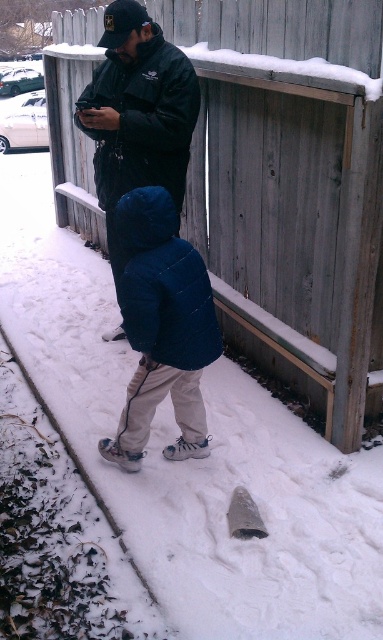
Question: Does gray wood fence at upper center appear under matte black jacket at center?

Choices:
 (A) no
 (B) yes

Answer: (B)

Question: Which point is farther from the camera taking this photo?

Choices:
 (A) (137, 204)
 (B) (340, 314)
 (C) (104, 40)

Answer: (C)

Question: Which object appears closest to the camera in this image?

Choices:
 (A) matte black jacket at center
 (B) gray wood fence at upper center

Answer: (B)

Question: Does dark blue puffy jacket at center have a lesser width compared to matte black jacket at center?

Choices:
 (A) yes
 (B) no

Answer: (A)

Question: Does gray wood fence at upper center appear over dark blue puffy jacket at center?

Choices:
 (A) yes
 (B) no

Answer: (A)

Question: Which object is closer to the camera taking this photo?

Choices:
 (A) matte black jacket at center
 (B) gray wood fence at upper center

Answer: (B)